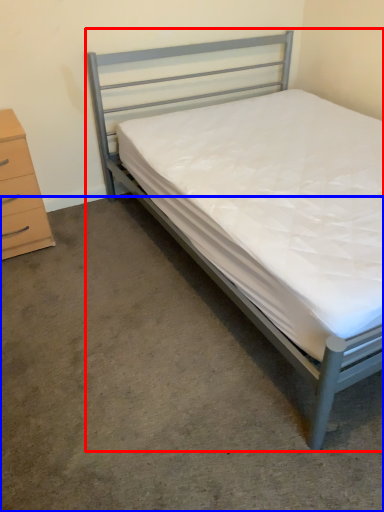
Question: Which of the following is the farthest to the observer, bed (highlighted by a red box) or concrete (highlighted by a blue box)?

Choices:
 (A) bed
 (B) concrete

Answer: (B)